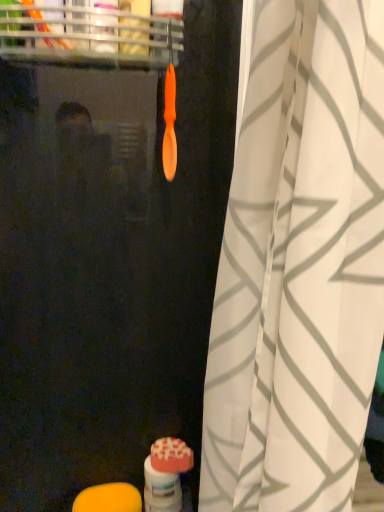
Question: Looking at the image, does orange matte soap at lower left, which is the 2th soap in right-to-left order, seem bigger or smaller compared to matte orange toothbrush at lower center?

Choices:
 (A) small
 (B) big

Answer: (A)

Question: From the image's perspective, is orange matte soap at lower left, positioned as the first soap in left-to-right order, above or below matte orange toothbrush at lower center?

Choices:
 (A) below
 (B) above

Answer: (A)

Question: Estimate the real-world distances between objects in this image. Which object is farther from the matte pink soap at lower center, acting as the second soap starting from the left?

Choices:
 (A) white textured curtain at center
 (B) orange matte soap at lower left, which is the second soap from top to bottom
 (C) matte orange toothbrush at lower center

Answer: (A)

Question: Considering the real-world distances, which object is farthest from the orange matte soap at lower left, which is the 1th soap from bottom to top?

Choices:
 (A) matte orange toothbrush at lower center
 (B) matte pink soap at lower center, which is counted as the 1th soap, starting from the top
 (C) white textured curtain at center

Answer: (C)